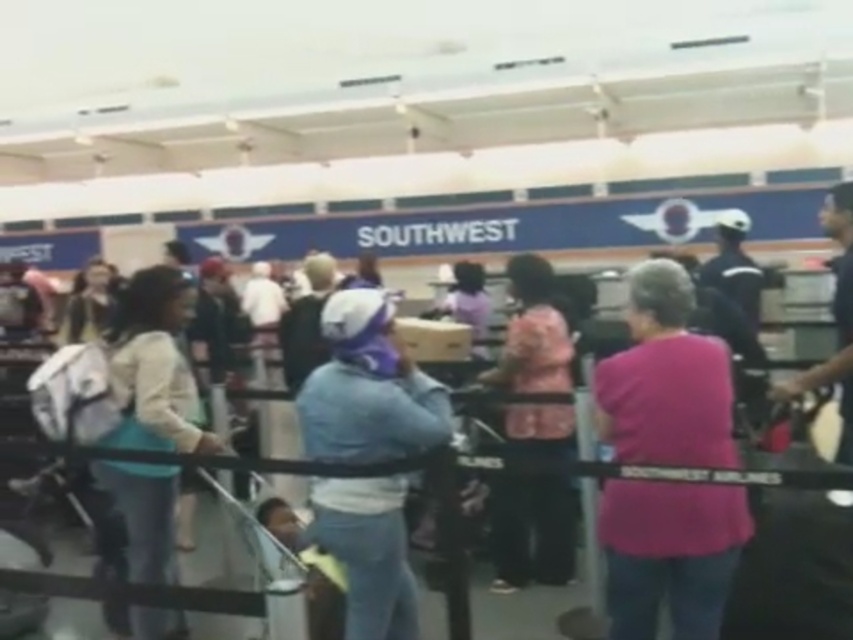
You are a Southwest Airlines employee observing the checkin counter. You need to retrieve a lost item from the teal fabric backpack at left and the pink fabric purse at center. Which item is closer to the counter?

The teal fabric backpack at left is to the left of the pink fabric purse at center, so the teal fabric backpack at left is closer to the counter.

You are standing at the Southwest Airlines checkin counter and see the teal fabric backpack at left. Where is it positioned relative to the counter?

The teal fabric backpack at left is located at point 0.570 on the x axis and 0.184 on the y axis relative to the counter.

You are a Southwest Airlines employee observing the checkin counter area. You notice the teal fabric backpack at left and the pink fabric purse at center. Which of these two items is shorter in height?

The teal fabric backpack at left is shorter in height compared to the pink fabric purse at center.